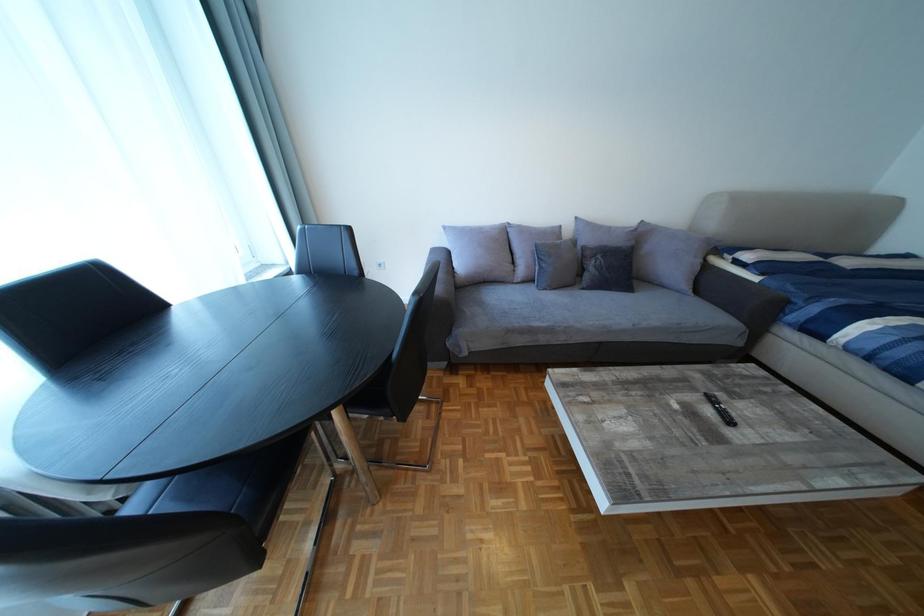
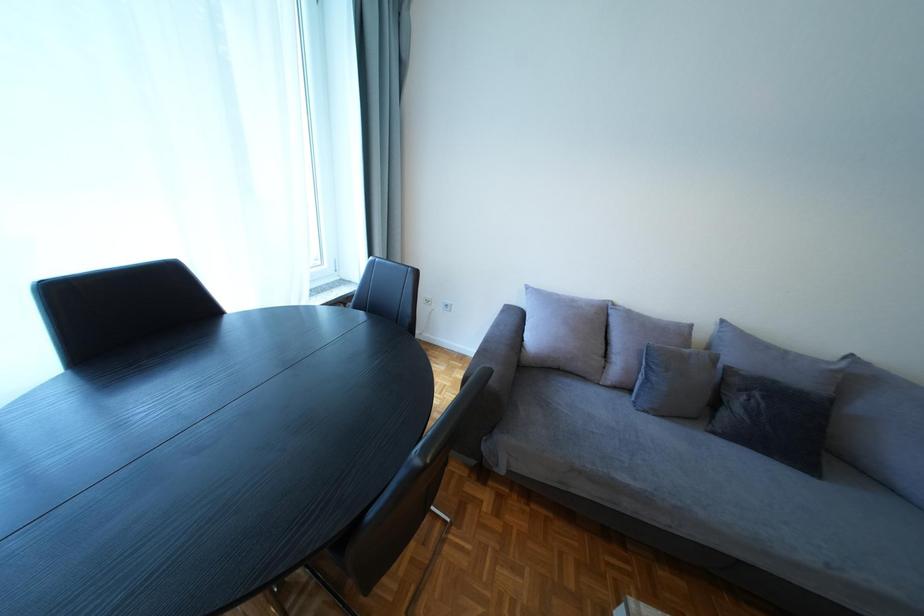
Question: Which direction would the cameraman need to move to produce the second image? Reply with the corresponding letter.

Choices:
 (A) Left
 (B) Right
 (C) Forward
 (D) Backward

Answer: (C)